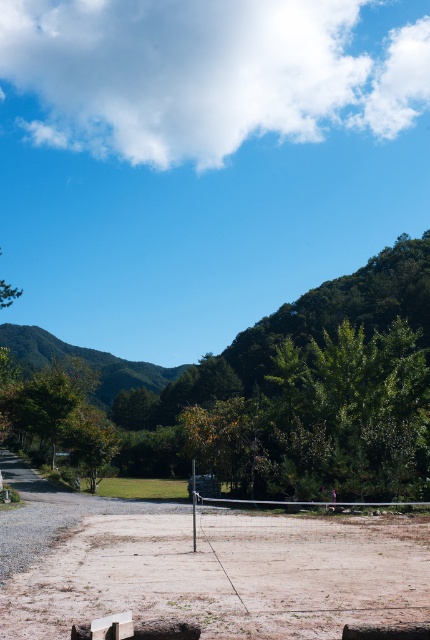
Does green leafy tree at center come in front of brown sandy dirt field at center?

No.

Is point (251, 461) less distant than point (174, 544)?

No, (251, 461) is further to viewer.

Locate an element on the screen. green leafy tree at center is located at coordinates (301, 396).